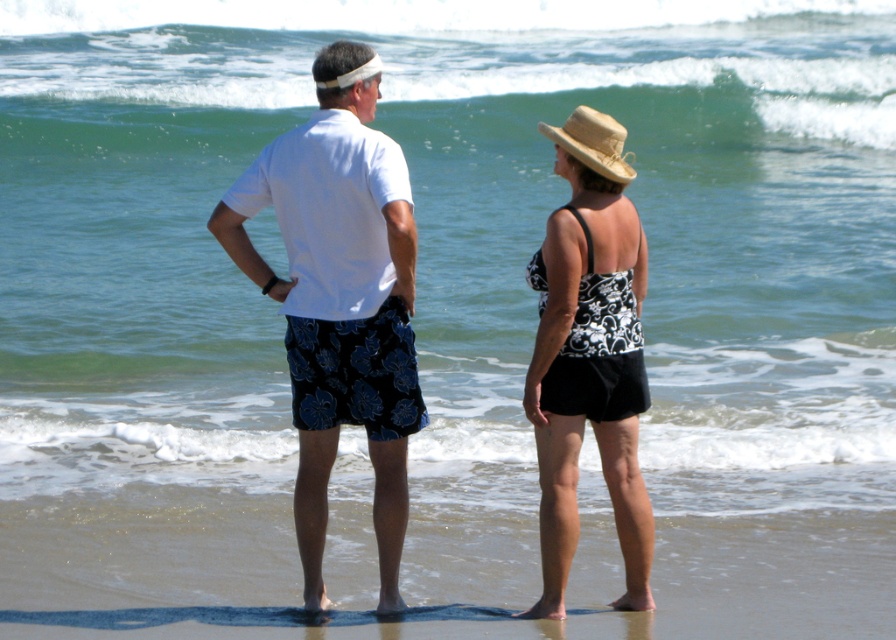
You are standing on the beach and want to reach a specific point marked at coordinates point (46, 582). If you start walking straight ahead from your current position, will you reach that point before walking 10 meters?

The point (46, 582) is 9.17 meters from the viewer. Since 9.17 meters is less than 10 meters, you will reach the point before walking 10 meters.

In the scene shown: You are a photographer trying to capture a photo of the white cotton shirt at center. To ensure the brown sand at lower center is visible in the background, where should you position the camera relative to the shirt?

The brown sand at lower center is located below the white cotton shirt at center, so positioning the camera above the shirt would allow the sand to be seen in the background.

You are standing on the beach and want to place a small bucket exactly where the brown sand at lower center and the white matte shirt at center are located. Which location is to the right of the other?

The brown sand at lower center is to the right of the white matte shirt at center.